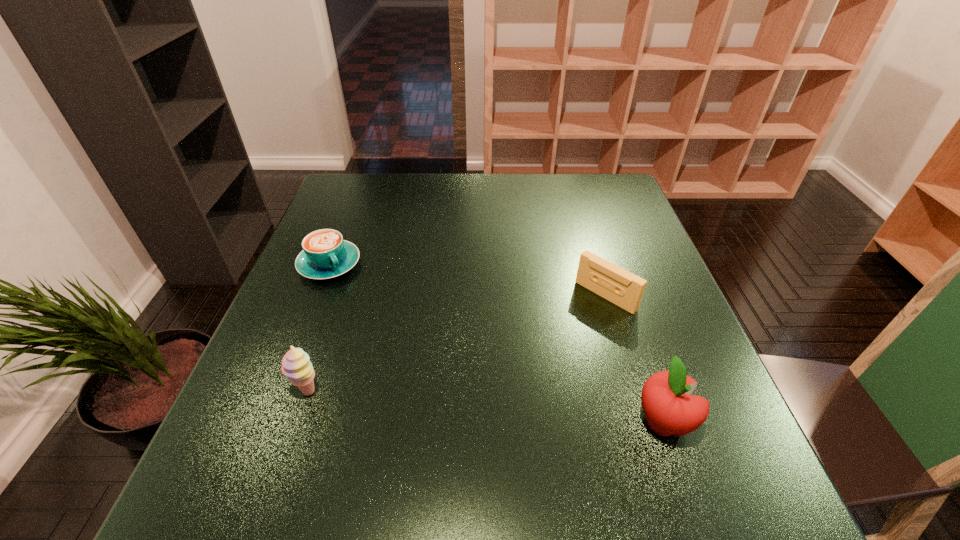
The height and width of the screenshot is (540, 960). Find the location of `free spot at the left edge of the desktop`. free spot at the left edge of the desktop is located at coordinates (323, 372).

In the image, there is a desktop. Find the location of `vacant space at the right edge`. vacant space at the right edge is located at coordinates 636,375.

In the image, there is a desktop. Where is `free space at the far left corner`? Image resolution: width=960 pixels, height=540 pixels. free space at the far left corner is located at coordinates (354, 181).

In the image, there is a desktop. Identify the location of vacant space at the far right corner. (588, 211).

Where is `empty space that is in between the third tallest object and the sherbert`? empty space that is in between the third tallest object and the sherbert is located at coordinates (457, 344).

Locate an element on the screen. vacant area that lies between the third tallest object and the cappuccino is located at coordinates (468, 280).

Image resolution: width=960 pixels, height=540 pixels. Find the location of `empty space between the sherbert and the apple`. empty space between the sherbert and the apple is located at coordinates [486, 407].

Locate an element on the screen. blank region between the apple and the shortest object is located at coordinates pyautogui.click(x=496, y=343).

Identify the location of blank region between the videotape and the apple. The width and height of the screenshot is (960, 540). (635, 359).

At what (x,y) coordinates should I click in order to perform the action: click on free space between the shortest object and the apple. Please return your answer as a coordinate pair (x, y). The image size is (960, 540). Looking at the image, I should click on (496, 343).